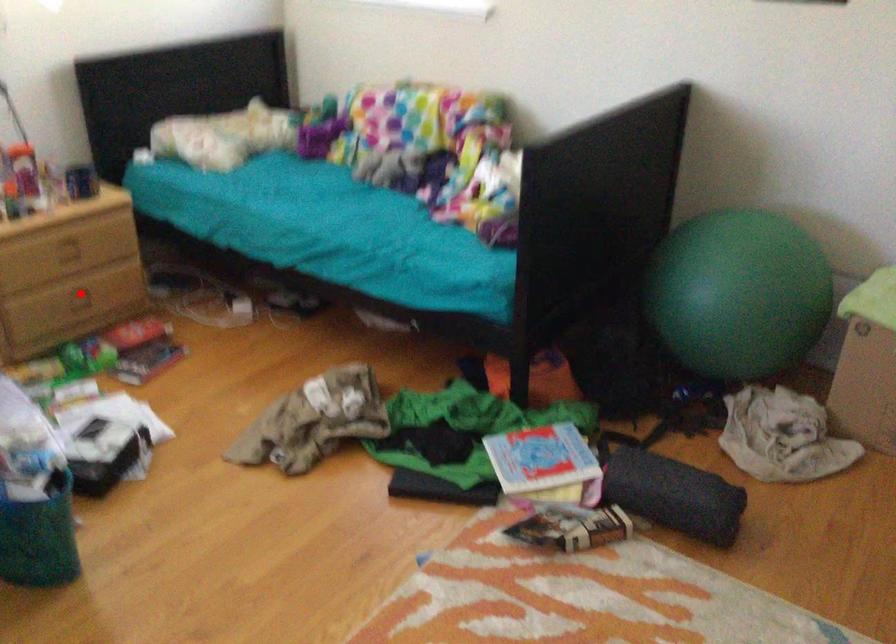
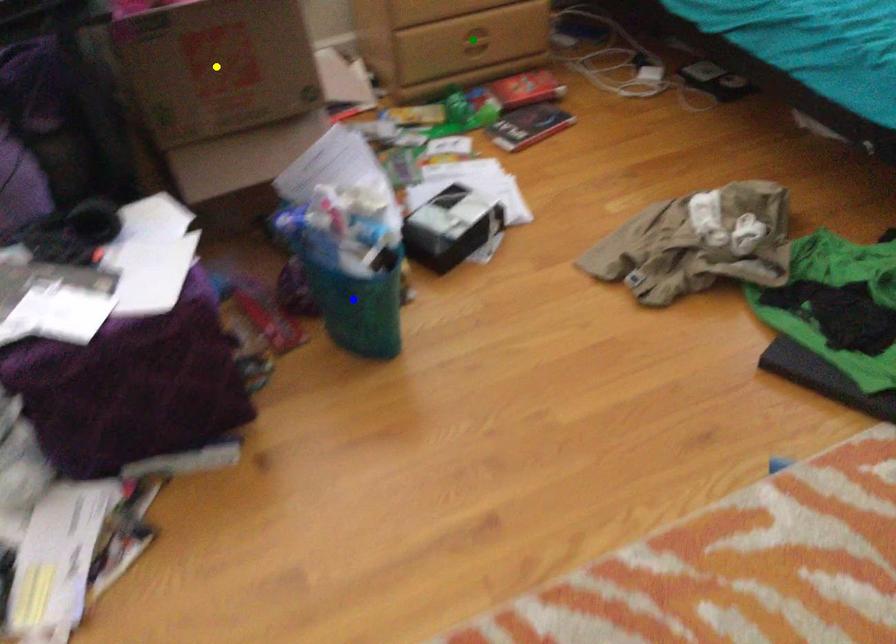
Question: I am providing you with two images of the same scene from different viewpoints. A red point is marked on the first image. You are given multiple points on the second image. Which spot in image 2 lines up with the point in image 1?

Choices:
 (A) yellow point
 (B) green point
 (C) blue point

Answer: (B)